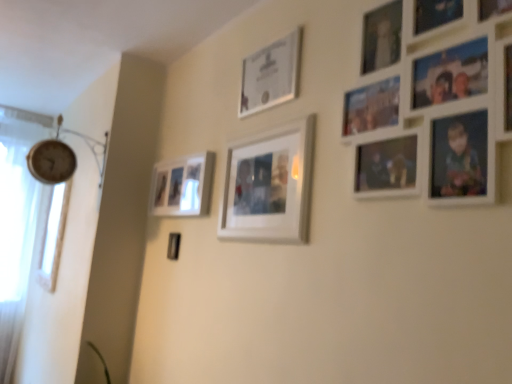
Question: Is matte silver frame at upper center, placed as the 2th picture frame when sorted from back to front, closer to the viewer compared to matte white picture frame at center left, which is counted as the fourth picture frame, starting from the front?

Choices:
 (A) no
 (B) yes

Answer: (B)

Question: Considering the relative sizes of matte silver frame at upper center, which ranks as the second picture frame in right-to-left order, and matte white picture frame at center left, which is counted as the fourth picture frame, starting from the right, in the image provided, is matte silver frame at upper center, which ranks as the second picture frame in right-to-left order, smaller than matte white picture frame at center left, which is counted as the fourth picture frame, starting from the right,?

Choices:
 (A) yes
 (B) no

Answer: (A)

Question: Does matte silver frame at upper center, marked as the third picture frame in a front-to-back arrangement, have a greater width compared to matte white picture frame at center left, which is counted as the fourth picture frame, starting from the right?

Choices:
 (A) yes
 (B) no

Answer: (B)

Question: Is matte silver frame at upper center, placed as the 3th picture frame when sorted from left to right, completely or partially outside of matte white picture frame at center left, which is counted as the fourth picture frame, starting from the right?

Choices:
 (A) no
 (B) yes

Answer: (B)

Question: From the image's perspective, is matte silver frame at upper center, placed as the 3th picture frame when sorted from left to right, over matte white picture frame at center left, which is counted as the fourth picture frame, starting from the right?

Choices:
 (A) yes
 (B) no

Answer: (A)

Question: From the image's perspective, is matte silver frame at upper center, placed as the 2th picture frame when sorted from back to front, under matte white picture frame at center left, which is counted as the fourth picture frame, starting from the front?

Choices:
 (A) no
 (B) yes

Answer: (A)

Question: Does white matte picture frame at upper right, the 4th picture frame when ordered from left to right, appear on the left side of white matte picture frame at center, arranged as the 2th picture frame when viewed from the left?

Choices:
 (A) yes
 (B) no

Answer: (B)

Question: Can you confirm if white matte picture frame at upper right, the 4th picture frame when ordered from left to right, is thinner than white matte picture frame at center, which is counted as the second picture frame, starting from the front?

Choices:
 (A) yes
 (B) no

Answer: (A)

Question: Is white matte picture frame at upper right, which is counted as the 1th picture frame, starting from the right, further to the viewer compared to white matte picture frame at center, positioned as the third picture frame in right-to-left order?

Choices:
 (A) yes
 (B) no

Answer: (B)

Question: Are white matte picture frame at upper right, which is counted as the 1th picture frame, starting from the right, and white matte picture frame at center, arranged as the 2th picture frame when viewed from the left, far apart?

Choices:
 (A) no
 (B) yes

Answer: (A)

Question: From the image's perspective, does white matte picture frame at upper right, which is counted as the 1th picture frame, starting from the front, appear higher than white matte picture frame at center, arranged as the 2th picture frame when viewed from the left?

Choices:
 (A) yes
 (B) no

Answer: (A)

Question: From the image's perspective, does white matte picture frame at upper right, which is counted as the 1th picture frame, starting from the front, appear lower than white matte picture frame at center, which is counted as the second picture frame, starting from the front?

Choices:
 (A) yes
 (B) no

Answer: (B)

Question: Would you say white matte picture frame at center, which is counted as the second picture frame, starting from the front, is part of matte white picture frame at center left, the first picture frame in the back-to-front sequence,'s contents?

Choices:
 (A) yes
 (B) no

Answer: (B)